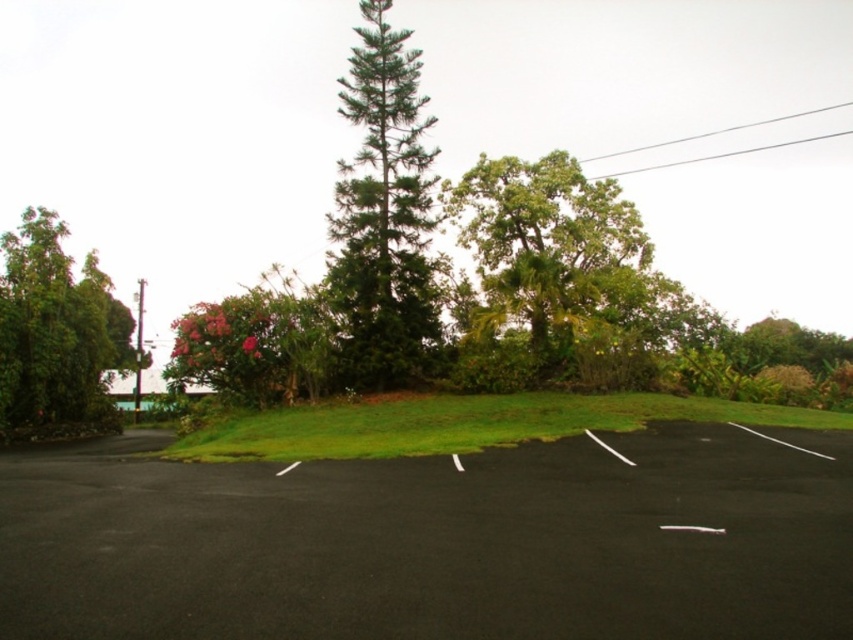
Between green leafy tree at center and green textured tree at center, which one is positioned lower?

Positioned lower is green leafy tree at center.

Locate an element on the screen. The image size is (853, 640). green leafy tree at center is located at coordinates (560, 257).

Can you confirm if green grassy hillside at center is smaller than green leafy tree at left?

Yes.

Describe the element at coordinates (462, 422) in the screenshot. I see `green grassy hillside at center` at that location.

The image size is (853, 640). What are the coordinates of `green grassy hillside at center` in the screenshot? It's located at (462, 422).

Between black asphalt parking lot at center and pink leafy tree at center-left, which one has more height?

pink leafy tree at center-left

Does black asphalt parking lot at center appear on the left side of pink leafy tree at center-left?

In fact, black asphalt parking lot at center is to the right of pink leafy tree at center-left.

Find the location of a particular element. Image resolution: width=853 pixels, height=640 pixels. black asphalt parking lot at center is located at coordinates (434, 541).